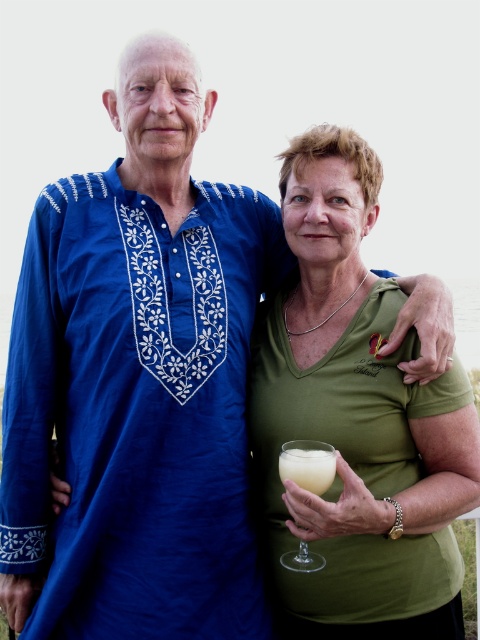
You are a photographer trying to capture a closeup of the clear glass wine glass at lower center without the green matte shirt at center overlapping it. Given their widths, is this feasible?

The green matte shirt at center is wider than the clear glass wine glass at lower center, so it might be challenging to avoid overlap unless the camera angle is adjusted to focus solely on the glass.

You are a photographer aiming to capture a closeup of the pale yellow liquid at lower center without the green matte shirt at center obstructing the view. Is this possible given their positions?

The green matte shirt at center is located above the pale yellow liquid at lower center, so adjusting the camera angle downward might allow you to capture the pale yellow liquid at lower center without obstruction from the green matte shirt at center.

You are a bartender at a party and need to pour the pale yellow liquid at lower center into the clear glass wine glass at lower center. Can you do this without spilling?

The distance between the clear glass wine glass at lower center and the pale yellow liquid at lower center is only 0.98 centimeters, so you can pour the liquid into the glass without spilling as they are very close.